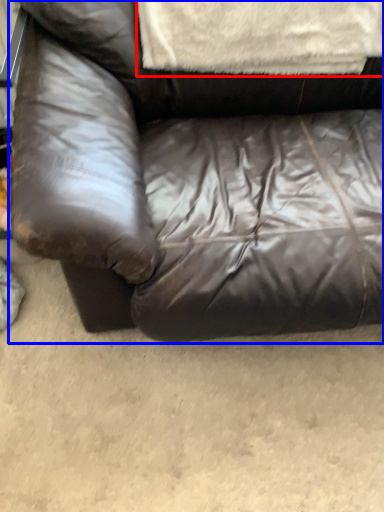
Question: Among these objects, which one is farthest to the camera, blanket (highlighted by a red box) or studio couch (highlighted by a blue box)?

Choices:
 (A) blanket
 (B) studio couch

Answer: (A)